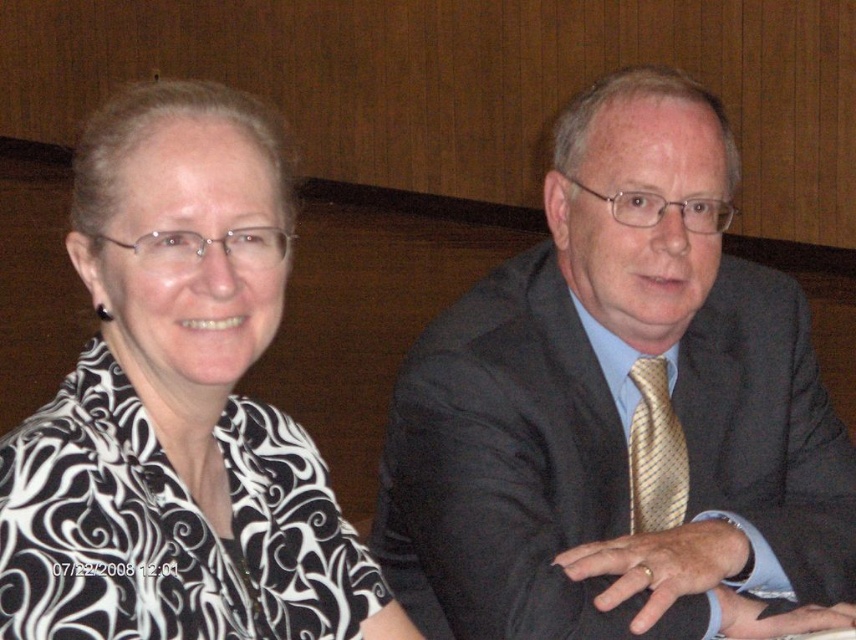
You are an event planner arranging a photo shoot for two speakers. You need to ensure that the black printed blouse at left and the gold striped tie at center are visible in the final shot. Based on their positions, which one is closer to the camera?

The black printed blouse at left is closer to the camera because it is in front of the gold striped tie at center.

You are standing in the conference room and want to move from the point at coordinates point (122,332) to the point at coordinates point (643,452). Which direction should you move to get closer to your destination?

To move from point (122,332) to point (643,452), you should move towards the upper right direction since point (643,452) is located behind and to the right of point (122,332).